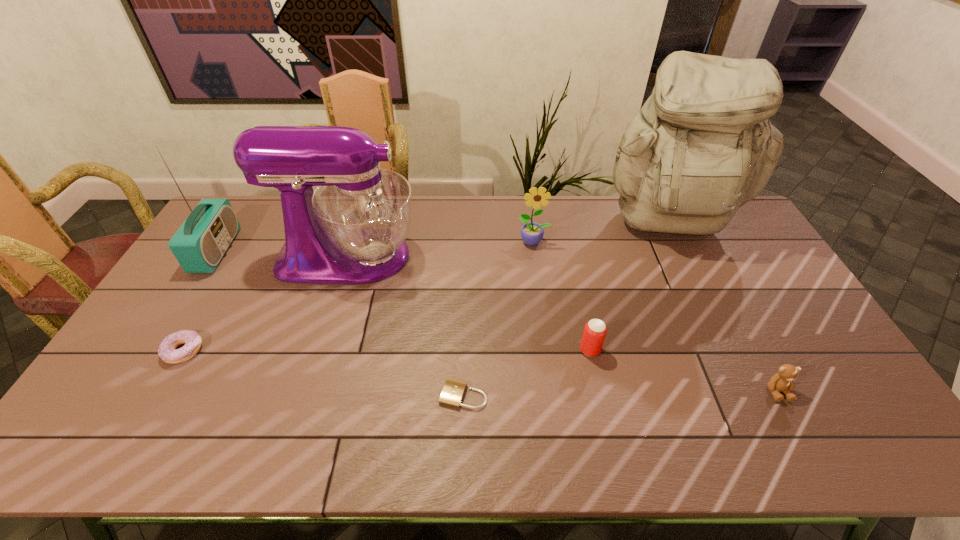
Where is `backpack that is positioned at the far edge`? backpack that is positioned at the far edge is located at coordinates (702, 146).

At what (x,y) coordinates should I click in order to perform the action: click on mixer that is at the far edge. Please return your answer as a coordinate pair (x, y). Looking at the image, I should click on (351, 229).

The width and height of the screenshot is (960, 540). I want to click on radio receiver that is at the far edge, so click(200, 243).

The width and height of the screenshot is (960, 540). Find the location of `sunflower at the far edge`. sunflower at the far edge is located at coordinates pos(532,233).

You are a GUI agent. You are given a task and a screenshot of the screen. Output one action in this format:
    pyautogui.click(x=<x>, y=<y>)
    Task: Click on the radio receiver located in the left edge section of the desktop
    The width and height of the screenshot is (960, 540).
    Given the screenshot: What is the action you would take?
    pyautogui.click(x=200, y=243)

Where is `doughnut at the left edge`? Image resolution: width=960 pixels, height=540 pixels. doughnut at the left edge is located at coordinates (167, 350).

Identify the location of object situated at the right edge. The height and width of the screenshot is (540, 960). (702, 146).

Locate an element on the screen. object that is at the far left corner is located at coordinates (200, 243).

Locate an element on the screen. This screenshot has width=960, height=540. object positioned at the far right corner is located at coordinates (702, 146).

Find the location of a particular element. This screenshot has width=960, height=540. blank area at the far edge is located at coordinates (411, 197).